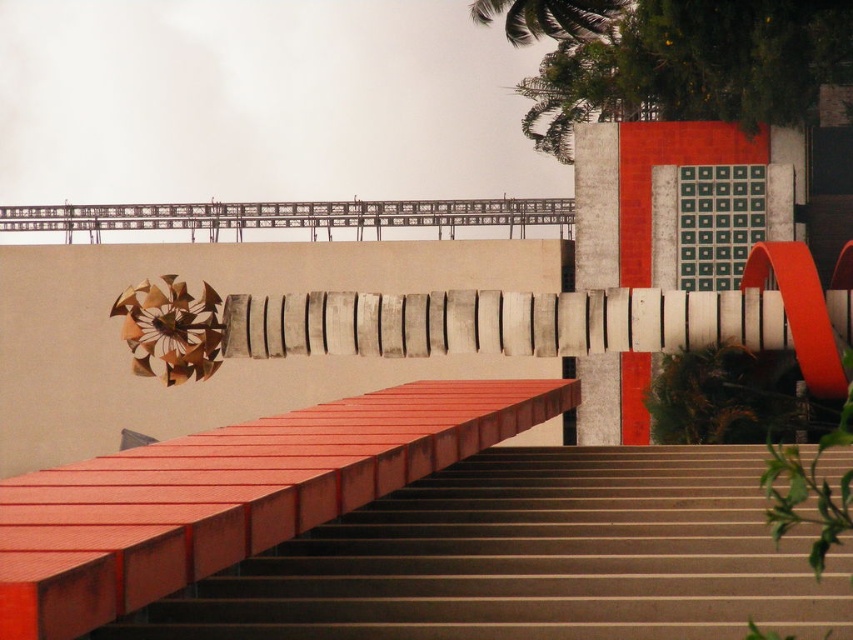
You are standing at the entrance of the architectural structure and want to reach the top of the brown concrete stairs at center. According to the coordinates provided, what is the exact position of the stairs?

The brown concrete stairs at center are located at point coordinates of (532, 557).

You are an architect evaluating the design of this space. Considering the brown concrete stairs at center and the metallic silver balustrade at upper center, which object would require more materials to construct based on their sizes?

The brown concrete stairs at center is larger in size than the metallic silver balustrade at upper center, so it would require more materials to construct.

You are standing at the base of the brown concrete stairs at center and want to reach the green leafy palm tree at upper center. Which direction should you move towards?

You should move towards the right because the brown concrete stairs at center are to the left of the green leafy palm tree at upper center, so moving right would bring you closer to the palm tree.